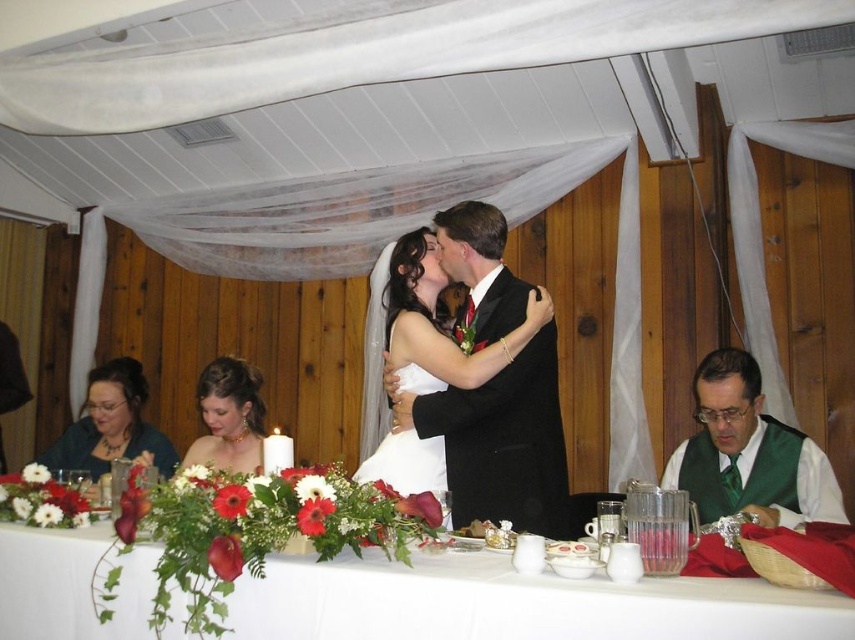
You are a guest at the wedding reception and notice two green items on the table. The green satin vest at lower right and the green fabric at left. Which one is taller?

The green satin vest at lower right is taller than the green fabric at left.

You are standing at the entrance of the wedding reception and want to take a photo of two points marked in the image. The first point is at coordinates point (x=535, y=336) and the second is at point (x=712, y=426). Which point is closer to you?

Point (x=535, y=336) is closer to the viewer than point (x=712, y=426).